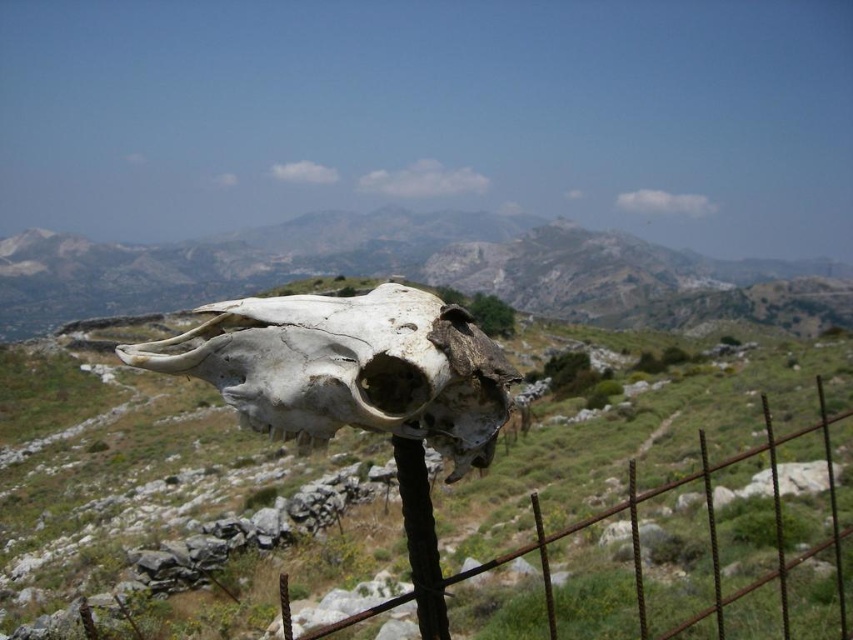
Question: Can you confirm if gray rocky mountain at center is positioned above rusty metal fence at center?

Choices:
 (A) yes
 (B) no

Answer: (A)

Question: Estimate the real-world distances between objects in this image. Which object is closer to the gray rocky mountain at center?

Choices:
 (A) rusty metal fence at center
 (B) white weathered skull at center

Answer: (A)

Question: From the image, what is the correct spatial relationship of gray rocky mountain at center in relation to white weathered skull at center?

Choices:
 (A) left
 (B) right

Answer: (A)

Question: Which object is closer to the camera taking this photo?

Choices:
 (A) gray rocky mountain at center
 (B) white weathered skull at center

Answer: (B)

Question: Among these objects, which one is farthest from the camera?

Choices:
 (A) rusty metal fence at center
 (B) gray rocky mountain at center
 (C) white weathered skull at center

Answer: (B)

Question: Can you confirm if gray rocky mountain at center is positioned below white weathered skull at center?

Choices:
 (A) yes
 (B) no

Answer: (B)